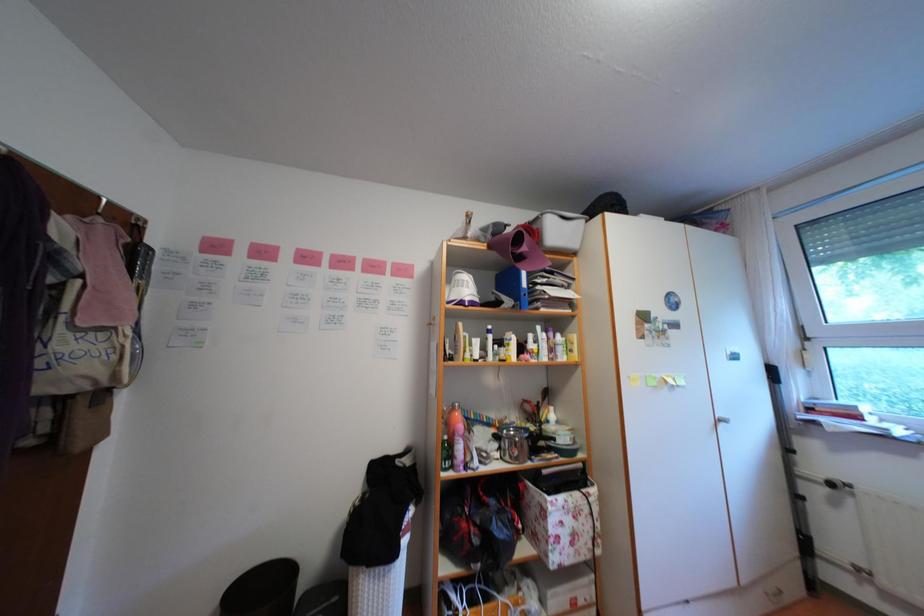
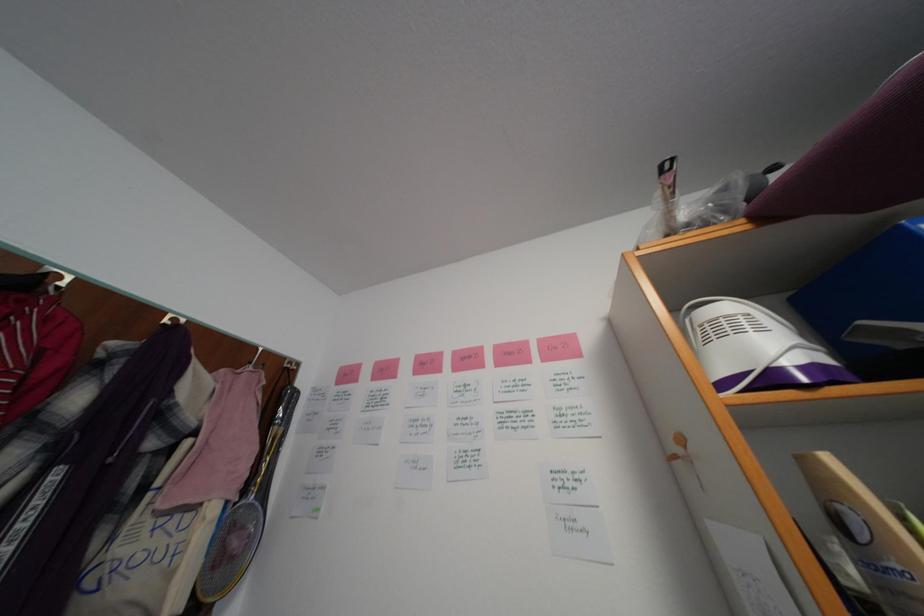
The first image is from the beginning of the video and the second image is from the end. How did the camera likely rotate when shooting the video?

The camera rotated toward left-up.